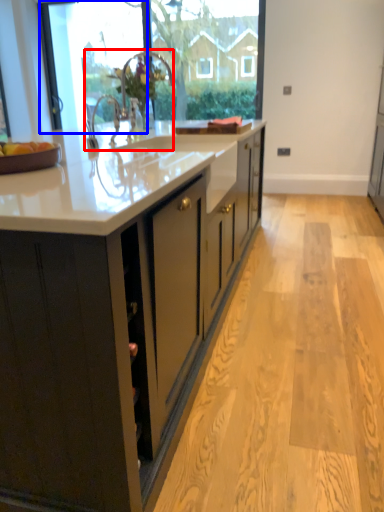
Question: Which point is closer to the camera, sink (highlighted by a red box) or glass door (highlighted by a blue box)?

Choices:
 (A) sink
 (B) glass door

Answer: (A)